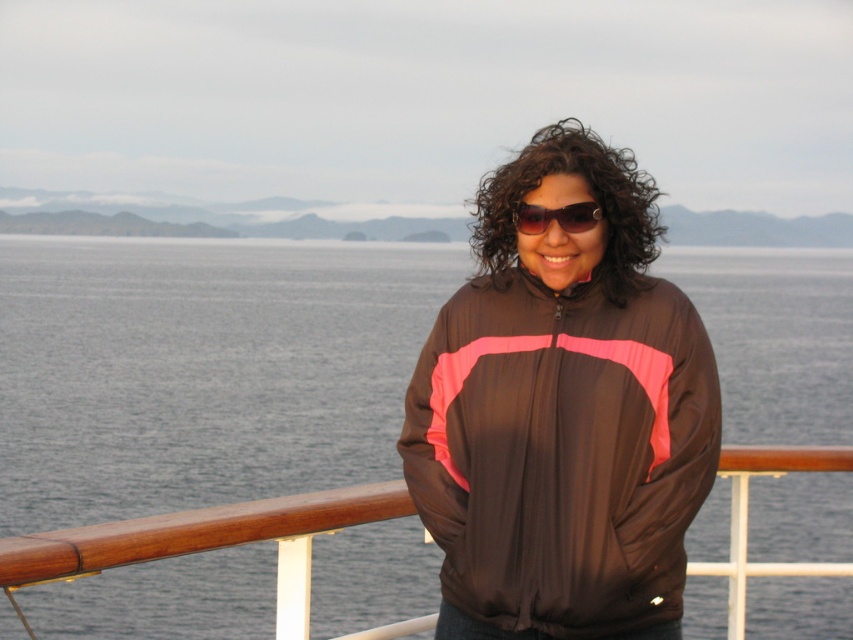
Question: Is matte black jacket at center smaller than sunglasses at center?

Choices:
 (A) yes
 (B) no

Answer: (B)

Question: Which of the following is the closest to the observer?

Choices:
 (A) (520, 212)
 (B) (593, 324)
 (C) (15, 401)

Answer: (A)

Question: Can you confirm if gray water at center is positioned to the left of matte black jacket at center?

Choices:
 (A) no
 (B) yes

Answer: (B)

Question: Which object is closer to the camera taking this photo?

Choices:
 (A) sunglasses at center
 (B) gray water at center
 (C) matte black jacket at center

Answer: (C)

Question: Does matte black jacket at center have a lesser width compared to sunglasses at center?

Choices:
 (A) yes
 (B) no

Answer: (B)

Question: Which of these objects is positioned farthest from the matte black jacket at center?

Choices:
 (A) sunglasses at center
 (B) gray water at center

Answer: (B)